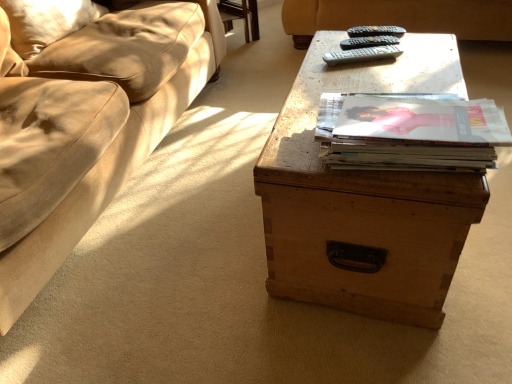
Image resolution: width=512 pixels, height=384 pixels. What are the coordinates of `free point to the left of black plastic remote at upper center, the 1th remote in the top-to-bottom sequence` in the screenshot? It's located at 329,41.